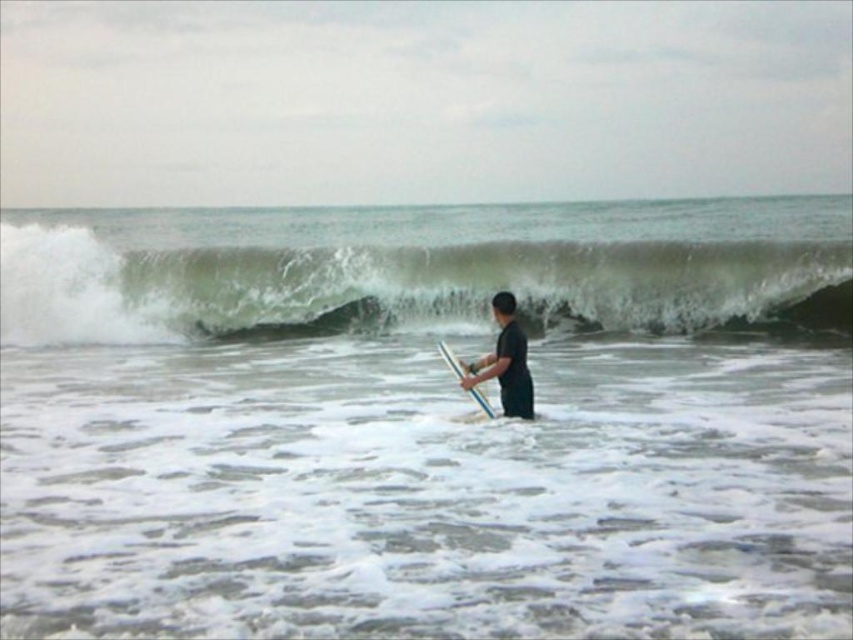
In the scene shown: Does white frothy wave at upper center have a greater height compared to white plastic surfboard at center?

Yes, white frothy wave at upper center is taller than white plastic surfboard at center.

Is white frothy wave at upper center positioned before white plastic surfboard at center?

That is False.

You are a GUI agent. You are given a task and a screenshot of the screen. Output one action in this format:
    pyautogui.click(x=<x>, y=<y>)
    Task: Click on the white frothy wave at upper center
    
    Given the screenshot: What is the action you would take?
    pyautogui.click(x=410, y=266)

Consider the image. Is the position of white frothy wave at upper center less distant than that of dark gray matte surfboard at center?

No, white frothy wave at upper center is further to the viewer.

Which of these two, white frothy wave at upper center or dark gray matte surfboard at center, stands taller?

white frothy wave at upper center is taller.

Who is more distant from viewer, (352, 230) or (517, 365)?

The point (352, 230) is behind.

Image resolution: width=853 pixels, height=640 pixels. I want to click on white frothy wave at upper center, so click(x=410, y=266).

Does dark gray matte surfboard at center have a greater height compared to white plastic surfboard at center?

Yes.

Is dark gray matte surfboard at center to the right of white plastic surfboard at center from the viewer's perspective?

Yes, dark gray matte surfboard at center is to the right of white plastic surfboard at center.

Between point (469, 378) and point (439, 340), which one is positioned in front?

Point (469, 378)

Where is `dark gray matte surfboard at center`? dark gray matte surfboard at center is located at coordinates (505, 362).